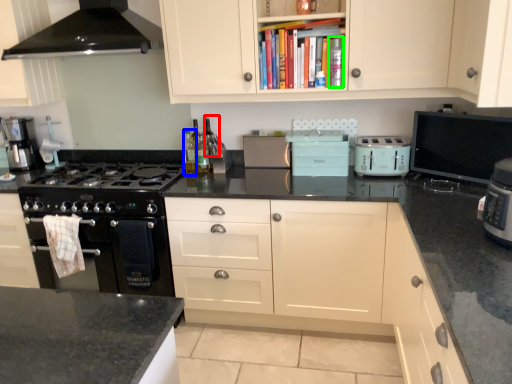
Question: Considering the real-world distances, which object is closest to wine bottle (highlighted by a red box)? bottle (highlighted by a blue box) or bottle (highlighted by a green box).

Choices:
 (A) bottle
 (B) bottle

Answer: (A)